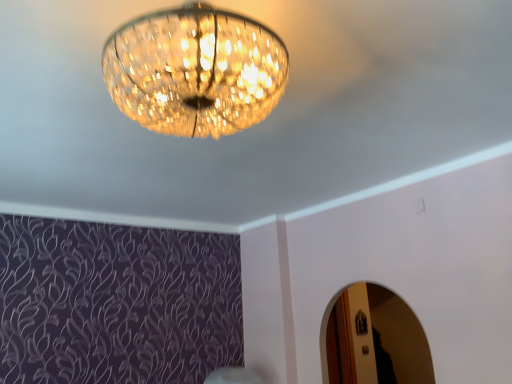
Question: Is crystal glass chandelier at upper center completely or partially inside metallic silver mirror at lower right?

Choices:
 (A) no
 (B) yes

Answer: (A)

Question: From a real-world perspective, is metallic silver mirror at lower right below crystal glass chandelier at upper center?

Choices:
 (A) no
 (B) yes

Answer: (B)

Question: Considering the relative positions of metallic silver mirror at lower right and crystal glass chandelier at upper center in the image provided, is metallic silver mirror at lower right behind crystal glass chandelier at upper center?

Choices:
 (A) yes
 (B) no

Answer: (A)

Question: Is metallic silver mirror at lower right far away from crystal glass chandelier at upper center?

Choices:
 (A) no
 (B) yes

Answer: (B)

Question: Is metallic silver mirror at lower right taller than crystal glass chandelier at upper center?

Choices:
 (A) no
 (B) yes

Answer: (B)

Question: Does metallic silver mirror at lower right have a lesser height compared to crystal glass chandelier at upper center?

Choices:
 (A) no
 (B) yes

Answer: (A)

Question: From the image's perspective, is crystal glass chandelier at upper center located beneath metallic silver mirror at lower right?

Choices:
 (A) no
 (B) yes

Answer: (A)

Question: Could you tell me if crystal glass chandelier at upper center is facing metallic silver mirror at lower right?

Choices:
 (A) yes
 (B) no

Answer: (B)

Question: Are crystal glass chandelier at upper center and metallic silver mirror at lower right located far from each other?

Choices:
 (A) no
 (B) yes

Answer: (B)

Question: From a real-world perspective, is crystal glass chandelier at upper center under metallic silver mirror at lower right?

Choices:
 (A) yes
 (B) no

Answer: (B)

Question: Is metallic silver mirror at lower right located within crystal glass chandelier at upper center?

Choices:
 (A) no
 (B) yes

Answer: (A)

Question: Is crystal glass chandelier at upper center closer to camera compared to metallic silver mirror at lower right?

Choices:
 (A) no
 (B) yes

Answer: (B)

Question: From a real-world perspective, is crystal glass chandelier at upper center above or below metallic silver mirror at lower right?

Choices:
 (A) above
 (B) below

Answer: (A)